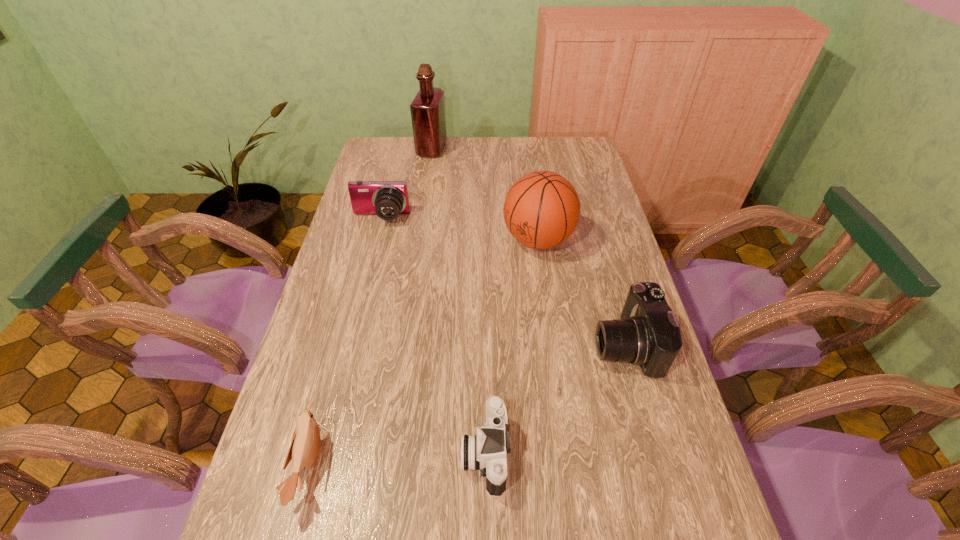
Identify the location of basketball present at the right edge. (541, 210).

You are a GUI agent. You are given a task and a screenshot of the screen. Output one action in this format:
    pyautogui.click(x=<x>, y=<y>)
    Task: Click on the camera at the right edge
    The width and height of the screenshot is (960, 540).
    Given the screenshot: What is the action you would take?
    647,334

I want to click on vacant space at the far edge of the desktop, so 471,145.

Where is `vacant space at the left edge`? This screenshot has height=540, width=960. vacant space at the left edge is located at coordinates (362, 241).

Find the location of a particular element. free space at the right edge of the desktop is located at coordinates (591, 274).

Find the location of a particular element. The image size is (960, 540). vacant region at the far right corner is located at coordinates (578, 139).

Find the location of a particular element. This screenshot has height=540, width=960. vacant area that lies between the second tallest object and the bird is located at coordinates (424, 353).

You are a GUI agent. You are given a task and a screenshot of the screen. Output one action in this format:
    pyautogui.click(x=<x>, y=<y>)
    Task: Click on the free space that is in between the fifth shortest object and the third nearest object
    This screenshot has width=960, height=540.
    Given the screenshot: What is the action you would take?
    pyautogui.click(x=582, y=292)

The width and height of the screenshot is (960, 540). I want to click on vacant space in between the nearest camera and the rightmost camera, so click(555, 399).

This screenshot has width=960, height=540. In order to click on vacant area that lies between the fourth object from left to right and the bird in this screenshot , I will do `click(397, 459)`.